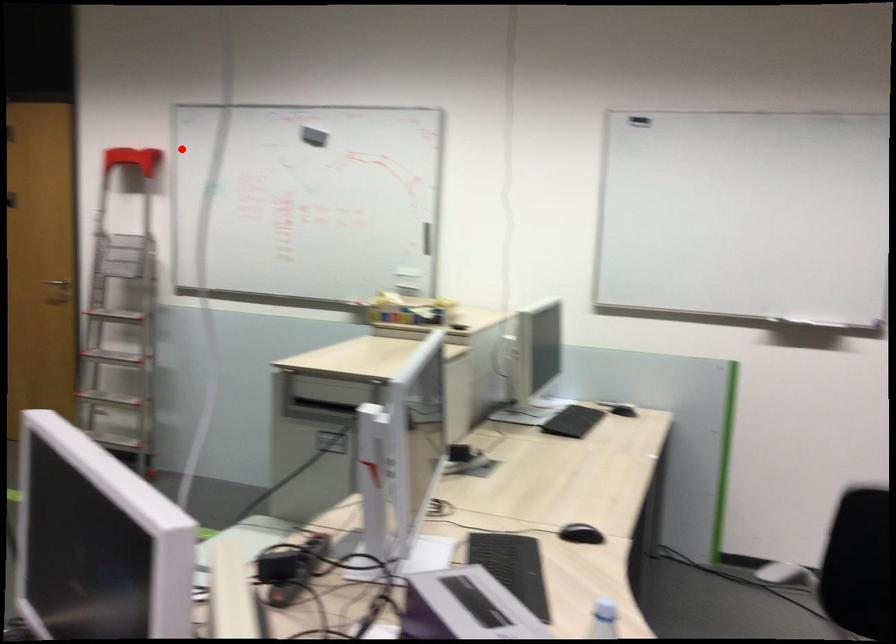
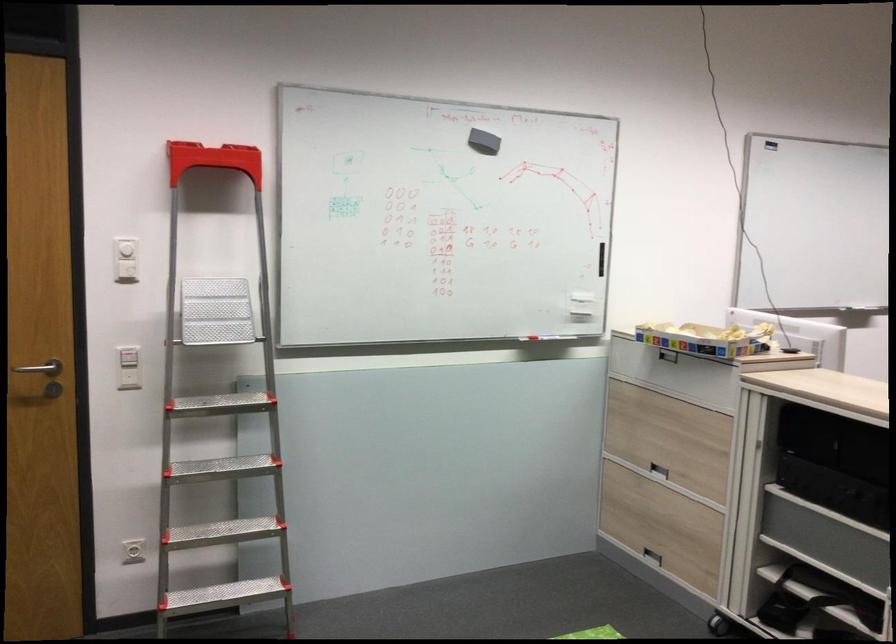
In the second image, find the point that corresponds to the highlighted location in the first image.

(213, 160)